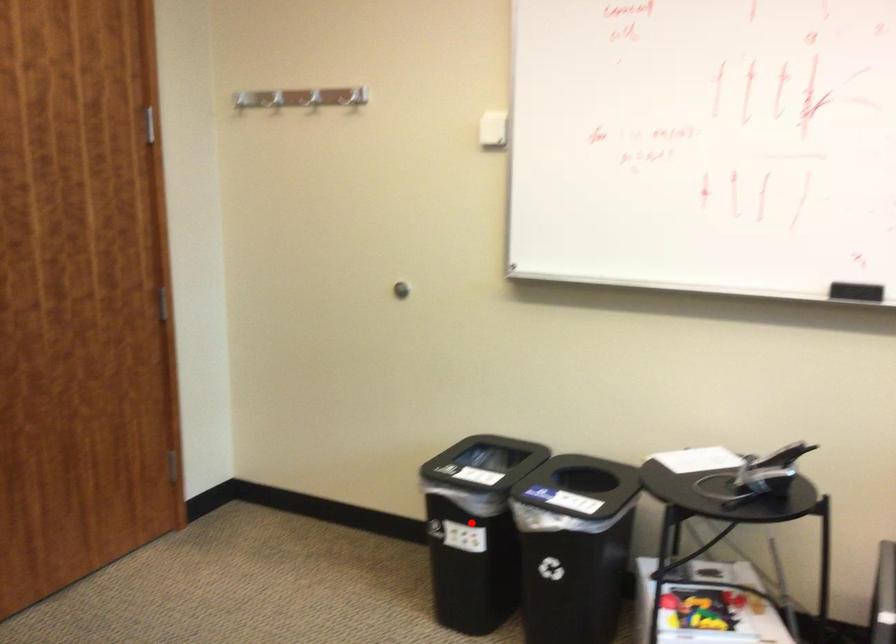
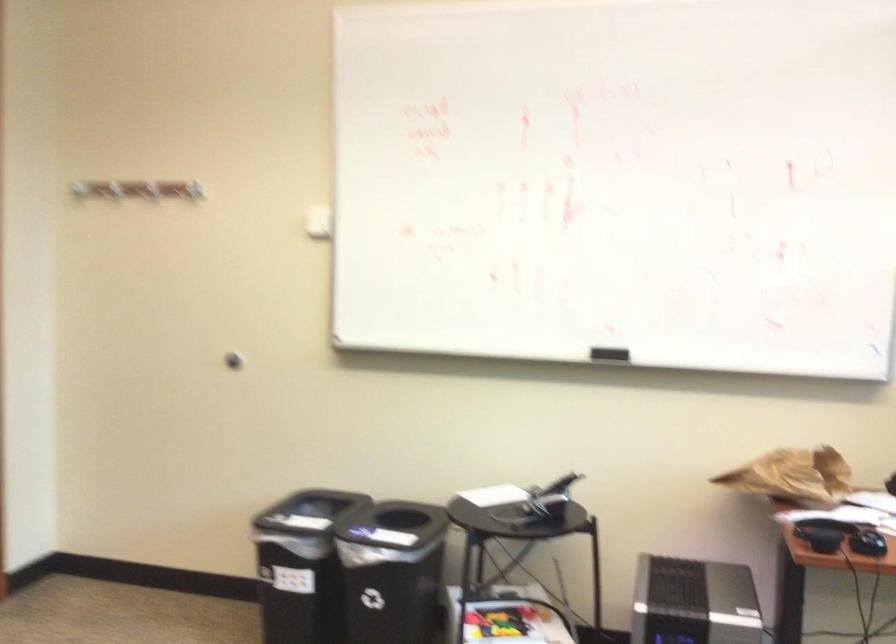
In the second image, find the point that corresponds to the highlighted location in the first image.

(300, 565)